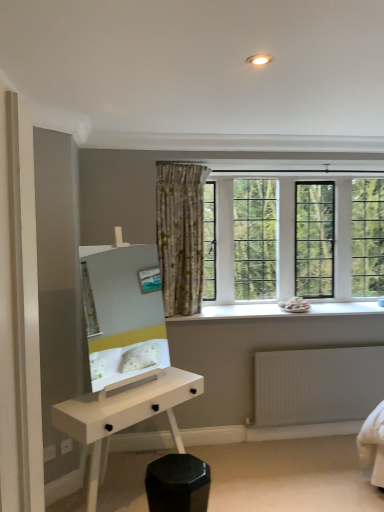
Question: Based on their positions, is white ribbed radiator at lower right located to the left or right of white glossy desk at lower center?

Choices:
 (A) left
 (B) right

Answer: (B)

Question: From a real-world perspective, is white ribbed radiator at lower right physically located above or below white glossy desk at lower center?

Choices:
 (A) above
 (B) below

Answer: (B)

Question: Estimate the real-world distances between objects in this image. Which object is farther from the white stone window sill at center?

Choices:
 (A) white glossy mirror at center
 (B) white glossy desk at lower center
 (C) clear glass windows at upper center
 (D) black matte hexagonal stool at lower center
 (E) white ribbed radiator at lower right

Answer: (D)

Question: Which object is the closest to the white ribbed radiator at lower right?

Choices:
 (A) white glossy desk at lower center
 (B) black matte hexagonal stool at lower center
 (C) white stone window sill at center
 (D) clear glass windows at upper center
 (E) white glossy mirror at center

Answer: (C)